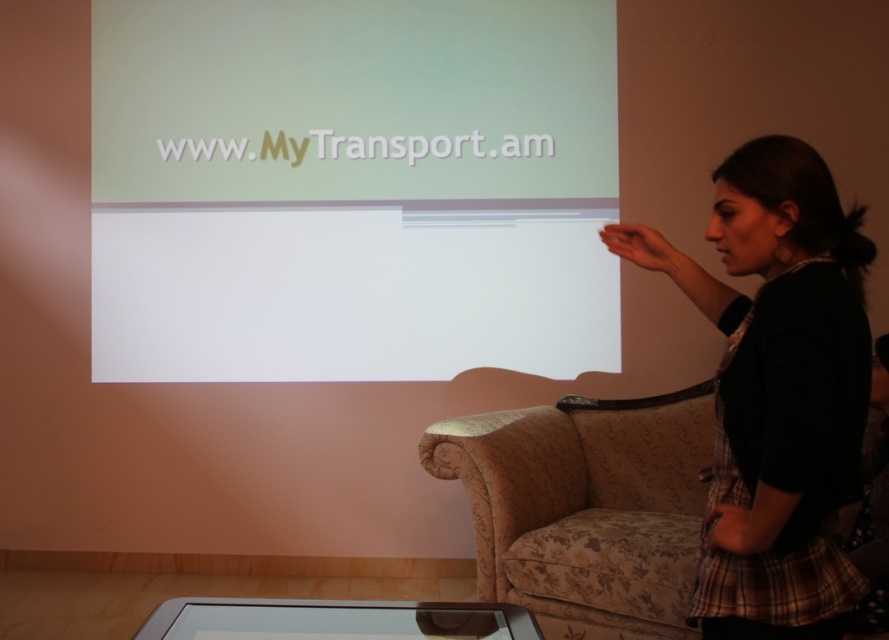
Question: Is white glossy projection screen at upper center above black fabric at right?

Choices:
 (A) no
 (B) yes

Answer: (B)

Question: Among these objects, which one is farthest from the camera?

Choices:
 (A) white glossy projection screen at upper center
 (B) patterned fabric couch at lower right
 (C) black fabric at right

Answer: (A)

Question: Estimate the real-world distances between objects in this image. Which object is farther from the white glossy projection screen at upper center?

Choices:
 (A) patterned fabric couch at lower right
 (B) black fabric at right

Answer: (B)

Question: Does white glossy projection screen at upper center appear over patterned fabric couch at lower right?

Choices:
 (A) no
 (B) yes

Answer: (B)

Question: Does white glossy projection screen at upper center appear on the right side of patterned fabric couch at lower right?

Choices:
 (A) yes
 (B) no

Answer: (B)

Question: Which object is positioned closest to the black fabric at right?

Choices:
 (A) white glossy projection screen at upper center
 (B) patterned fabric couch at lower right

Answer: (B)